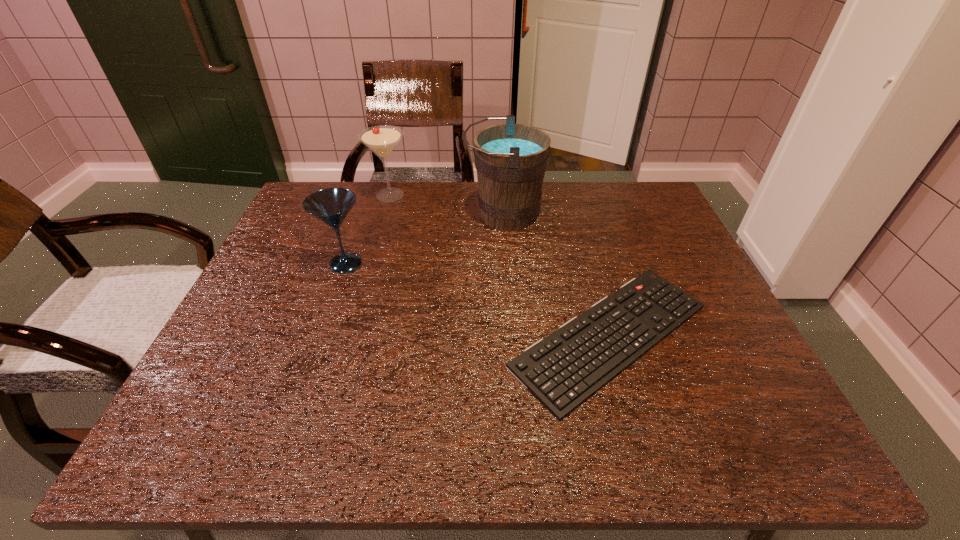
Where is `wine bucket`? wine bucket is located at coordinates (511, 159).

You are a GUI agent. You are given a task and a screenshot of the screen. Output one action in this format:
    pyautogui.click(x=<x>, y=<y>)
    Task: Click on the farther martini
    This screenshot has width=960, height=540.
    Given the screenshot: What is the action you would take?
    pyautogui.click(x=382, y=139)

The image size is (960, 540). What are the coordinates of `the nearer martini` in the screenshot? It's located at (331, 206).

Locate an element on the screen. This screenshot has width=960, height=540. the shortest object is located at coordinates (563, 370).

I want to click on free space located with a handle on the side of the tallest object, so click(x=340, y=215).

This screenshot has height=540, width=960. What are the coordinates of `free point located with a handle on the side of the tallest object` in the screenshot? It's located at (387, 215).

The height and width of the screenshot is (540, 960). Find the location of `vacant space situated with a handle on the side of the tallest object`. vacant space situated with a handle on the side of the tallest object is located at coordinates (360, 215).

Locate an element on the screen. The image size is (960, 540). vacant space situated on the front of the farther martini is located at coordinates (367, 276).

Locate an element on the screen. free point located 0.120m on the front of the nearer martini is located at coordinates (328, 314).

Find the location of `free region located 0.320m on the left of the computer keyboard`. free region located 0.320m on the left of the computer keyboard is located at coordinates (357, 336).